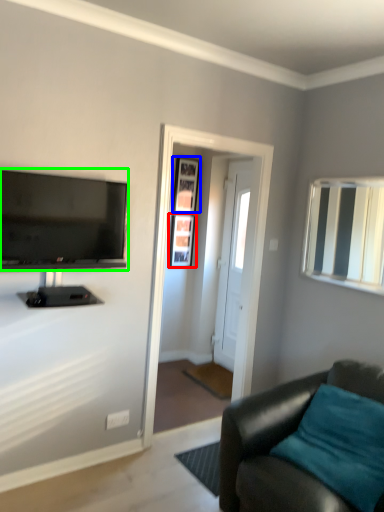
Question: Which object is the closest to the picture frame (highlighted by a red box)? Choose among these: picture frame (highlighted by a blue box) or television (highlighted by a green box).

Choices:
 (A) picture frame
 (B) television

Answer: (A)